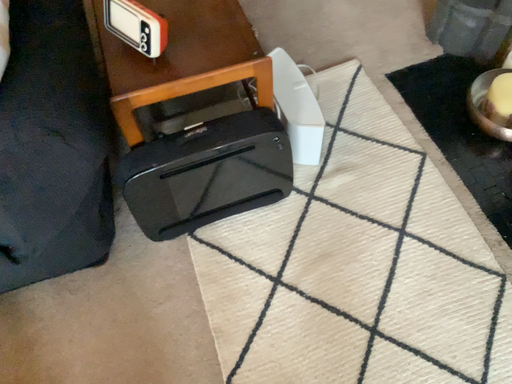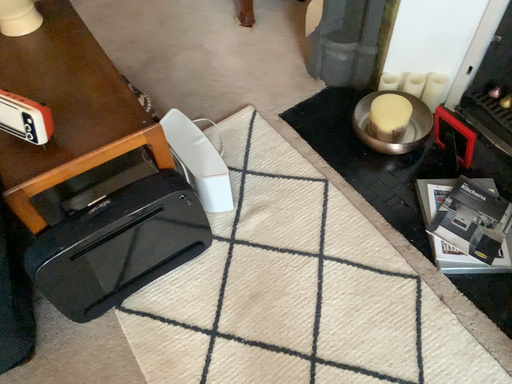
Question: How did the camera likely rotate when shooting the video?

Choices:
 (A) rotated left
 (B) rotated right

Answer: (B)